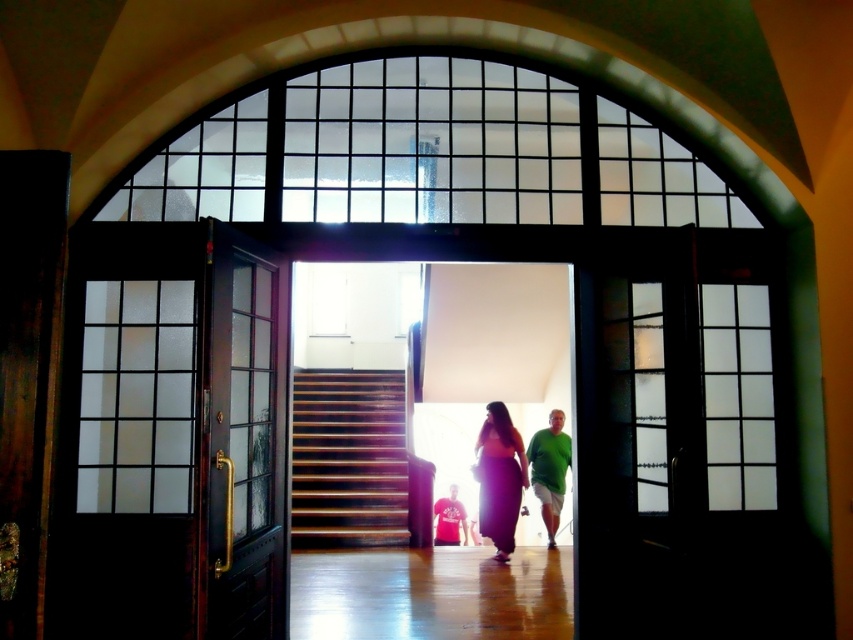
You are standing at the entrance of the room and want to walk towards the point marked at coordinates (546, 428). How far will you have to walk to reach that point?

The point marked at coordinates (546, 428) is 6.83 meters away from the camera, so you will have to walk approximately 6.83 meters to reach it.